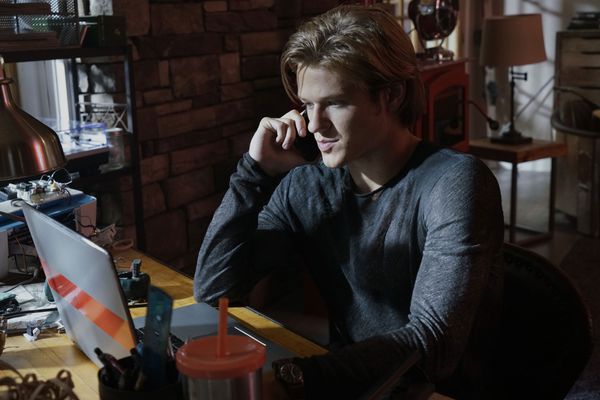
Locate an element on the screen. This screenshot has height=400, width=600. overhead light is located at coordinates (41, 149).